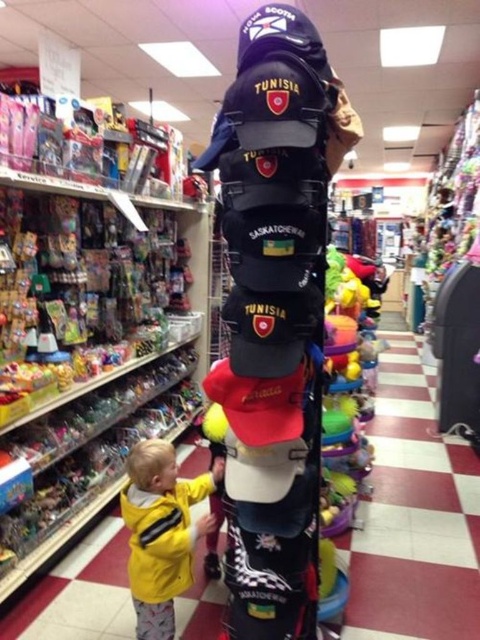
Does smooth plastic toys at center appear on the right side of yellow matte jacket at lower left?

Correct, you'll find smooth plastic toys at center to the right of yellow matte jacket at lower left.

Who is positioned more to the right, smooth plastic toys at center or yellow matte jacket at lower left?

smooth plastic toys at center is more to the right.

Is point (470, 468) positioned after point (145, 637)?

Yes, point (470, 468) is behind point (145, 637).

This screenshot has height=640, width=480. What are the coordinates of `smooth plastic toys at center` in the screenshot? It's located at point(415,516).